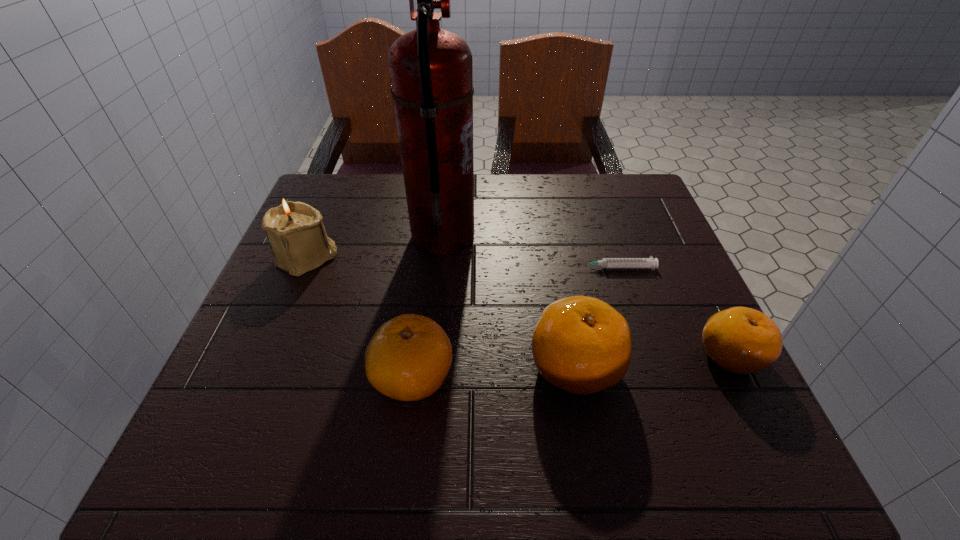
The height and width of the screenshot is (540, 960). In order to click on the second shortest clementine in this screenshot , I will do `click(408, 358)`.

This screenshot has height=540, width=960. Find the location of `the leftmost clementine`. the leftmost clementine is located at coordinates (408, 358).

You are a GUI agent. You are given a task and a screenshot of the screen. Output one action in this format:
    pyautogui.click(x=<x>, y=<y>)
    Task: Click on the second clementine from right to left
    
    Given the screenshot: What is the action you would take?
    pyautogui.click(x=582, y=345)

Where is `the rightmost clementine`? the rightmost clementine is located at coordinates (742, 340).

This screenshot has height=540, width=960. I want to click on the shortest clementine, so click(742, 340).

Locate an element on the screen. The image size is (960, 540). fire extinguisher is located at coordinates (431, 74).

Locate an element on the screen. the second tallest object is located at coordinates (295, 231).

Find the location of `the leftmost object`. the leftmost object is located at coordinates click(295, 231).

Identify the location of syringe. (652, 263).

Find the location of `vacant area situated on the right of the leftmost clementine`. vacant area situated on the right of the leftmost clementine is located at coordinates (533, 376).